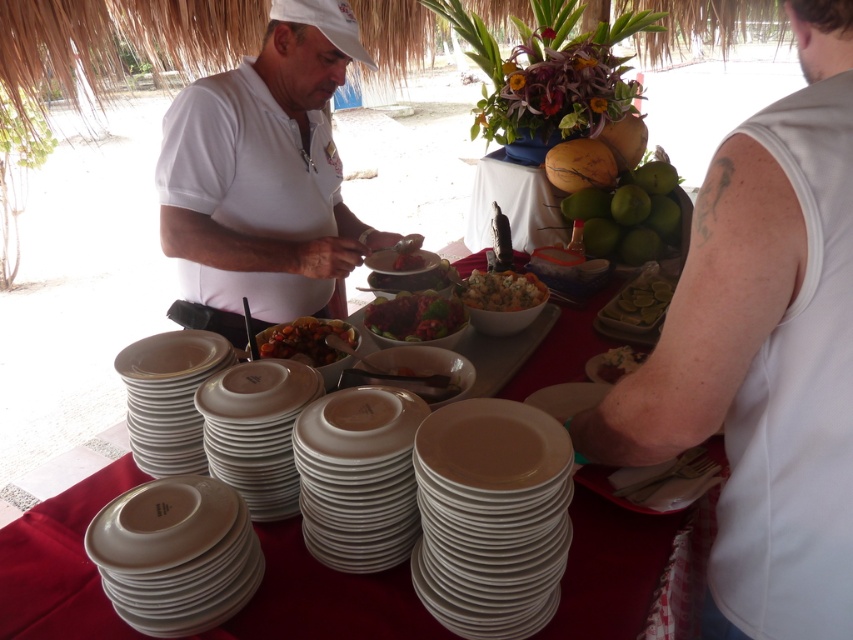
Question: Which point is farther to the camera?

Choices:
 (A) matte brown plate at lower right
 (B) shiny brown sauce at center
 (C) shiny red salad at center
 (D) white glossy plate at lower center

Answer: (A)

Question: Considering the relative positions of green matte limes at center-right and shiny red salad at center in the image provided, where is green matte limes at center-right located with respect to shiny red salad at center?

Choices:
 (A) right
 (B) left

Answer: (A)

Question: Which of the following is the farthest from the observer?

Choices:
 (A) (258, 156)
 (B) (425, 301)

Answer: (A)

Question: Can you confirm if white glossy plate at lower left is wider than green matte lime at center?

Choices:
 (A) no
 (B) yes

Answer: (A)

Question: Is white glossy plates at center above shiny red salad at center?

Choices:
 (A) yes
 (B) no

Answer: (B)

Question: Which object appears closest to the camera in this image?

Choices:
 (A) white glossy plate at lower center
 (B) matte white plate at center
 (C) white matte shirt at center
 (D) shiny red salad at center

Answer: (A)